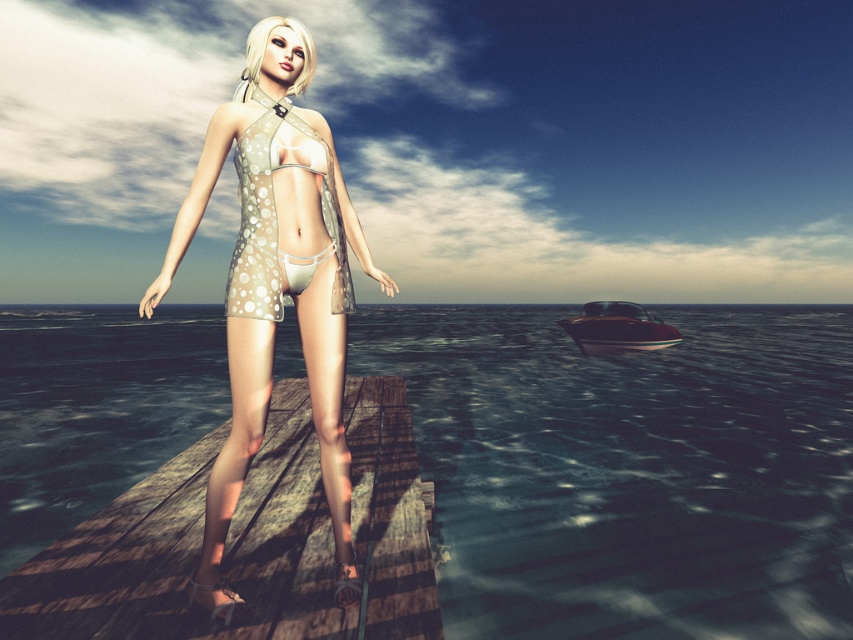
Question: Is wooden planks at center behind shiny brown wooden boat at lower right?

Choices:
 (A) yes
 (B) no

Answer: (B)

Question: Does matte beige swimsuit at center have a greater width compared to beige dotted fabric bikini at center?

Choices:
 (A) no
 (B) yes

Answer: (B)

Question: Which object is farther from the camera taking this photo?

Choices:
 (A) shiny brown wooden boat at lower right
 (B) translucent blue water at center

Answer: (A)

Question: Estimate the real-world distances between objects in this image. Which object is closer to the wooden planks at center?

Choices:
 (A) matte beige swimsuit at center
 (B) beige dotted fabric bikini at center
 (C) translucent blue water at center

Answer: (A)

Question: Based on their relative distances, which object is farther from the wooden planks at center?

Choices:
 (A) matte beige swimsuit at center
 (B) translucent blue water at center
 (C) shiny brown wooden boat at lower right

Answer: (B)

Question: Considering the relative positions of wooden planks at center and shiny brown wooden boat at lower right in the image provided, where is wooden planks at center located with respect to shiny brown wooden boat at lower right?

Choices:
 (A) above
 (B) below

Answer: (B)